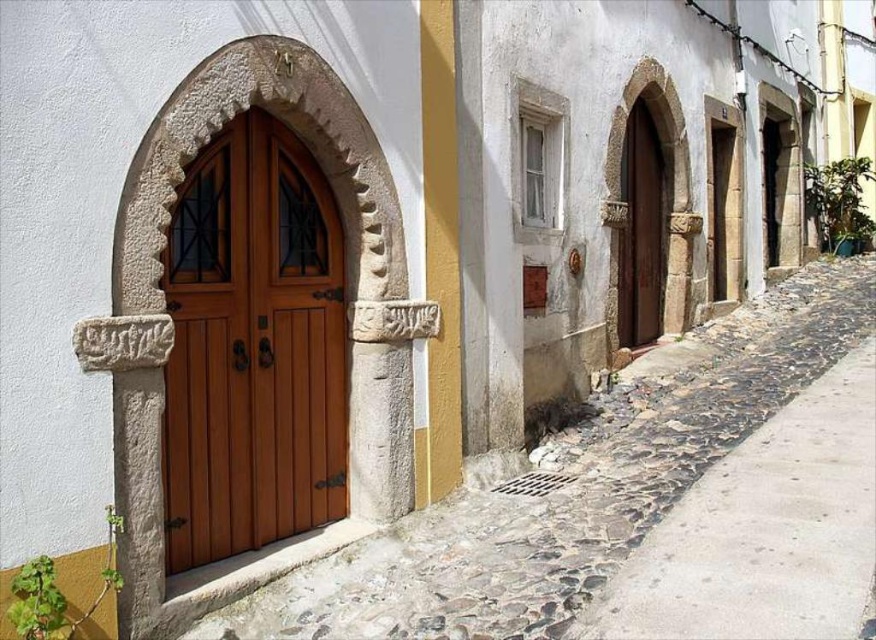
You are standing in front of the wooden door at center. You want to throw a small ball to hit the plaque above the door. The ball can travel 3.5 meters. Will it reach the plaque?

The wooden door at center is 4.09 meters away from the camera. Since the ball can only travel 3.5 meters, it won not reach the plaque above the door.

You are standing in front of the traditional house with the arched doorway. There are two points marked on the image. One is at coordinate point (x=574, y=540) and the other at point (x=644, y=156). Which point is closer to your current position?

Point (x=574, y=540) is closer to the camera than point (x=644, y=156), so the point at coordinate (x=574, y=540) is closer to your current position.